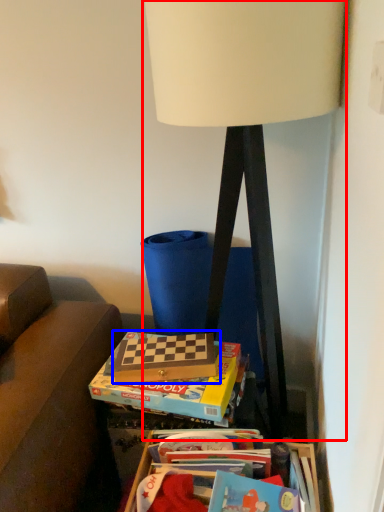
Question: Which of the following is the farthest to the observer, lamp (highlighted by a red box) or paperback book (highlighted by a blue box)?

Choices:
 (A) lamp
 (B) paperback book

Answer: (B)